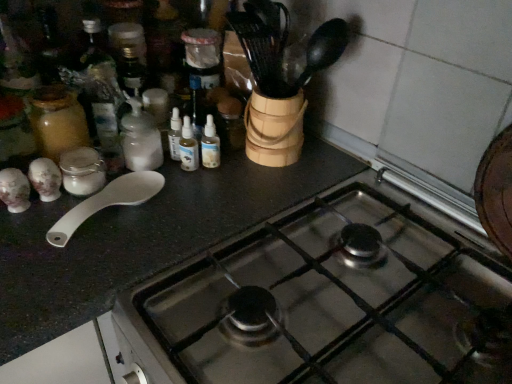
Question: Is white plastic spoon at left positioned with its back to stainless steel gas stove at center?

Choices:
 (A) yes
 (B) no

Answer: (B)

Question: Could stainless steel gas stove at center be considered to be inside white plastic spoon at left?

Choices:
 (A) yes
 (B) no

Answer: (B)

Question: Considering the relative sizes of white plastic spoon at left and stainless steel gas stove at center in the image provided, is white plastic spoon at left wider than stainless steel gas stove at center?

Choices:
 (A) no
 (B) yes

Answer: (A)

Question: Considering the relative sizes of white plastic spoon at left and stainless steel gas stove at center in the image provided, is white plastic spoon at left smaller than stainless steel gas stove at center?

Choices:
 (A) no
 (B) yes

Answer: (B)

Question: Can you confirm if white plastic spoon at left is bigger than stainless steel gas stove at center?

Choices:
 (A) yes
 (B) no

Answer: (B)

Question: Considering their positions, is white matte bottle at center-left located in front of or behind stainless steel gas stove at center?

Choices:
 (A) behind
 (B) front

Answer: (A)

Question: In the image, is white matte bottle at center-left on the left side or the right side of stainless steel gas stove at center?

Choices:
 (A) right
 (B) left

Answer: (B)

Question: From their relative heights in the image, would you say white matte bottle at center-left is taller or shorter than stainless steel gas stove at center?

Choices:
 (A) tall
 (B) short

Answer: (B)

Question: From a real-world perspective, is white matte bottle at center-left positioned above or below stainless steel gas stove at center?

Choices:
 (A) below
 (B) above

Answer: (B)

Question: From a real-world perspective, is white plastic spoon at left above or below white matte bottle at center-left?

Choices:
 (A) above
 (B) below

Answer: (B)

Question: Is point (67, 226) closer or farther from the camera than point (123, 92)?

Choices:
 (A) farther
 (B) closer

Answer: (B)

Question: Looking at their shapes, would you say white plastic spoon at left is wider or thinner than white matte bottle at center-left?

Choices:
 (A) wide
 (B) thin

Answer: (A)

Question: Is white plastic spoon at left inside the boundaries of white matte bottle at center-left, or outside?

Choices:
 (A) inside
 (B) outside

Answer: (B)

Question: From a real-world perspective, is stainless steel gas stove at center positioned above or below white matte bottle at center-left?

Choices:
 (A) above
 (B) below

Answer: (B)

Question: In terms of width, does stainless steel gas stove at center look wider or thinner when compared to white matte bottle at center-left?

Choices:
 (A) thin
 (B) wide

Answer: (B)